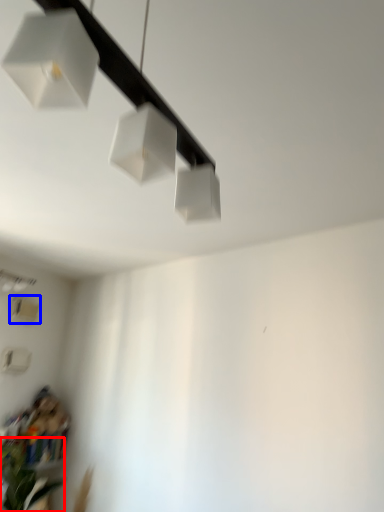
Question: Among these objects, which one is farthest to the camera, plant (highlighted by a red box) or lamp (highlighted by a blue box)?

Choices:
 (A) plant
 (B) lamp

Answer: (B)